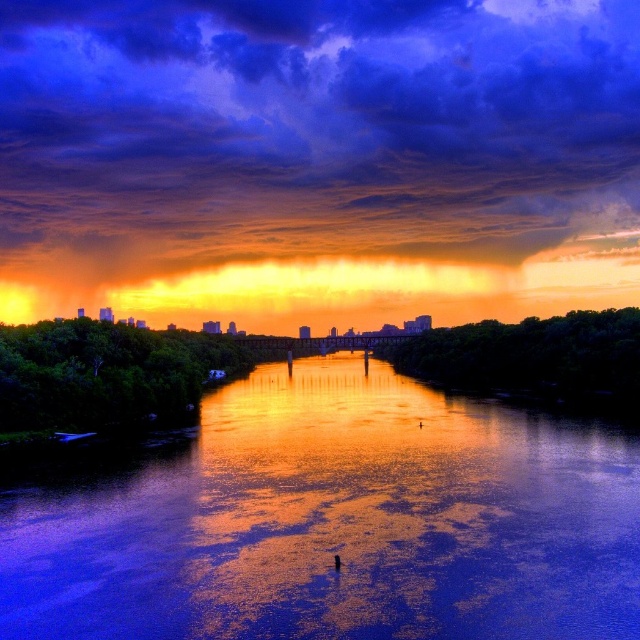
You are standing at the point with coordinates point (42, 604) and want to walk to the point with coordinates point (236, 317). However, there is a large tree blocking your path. Which point is closer to you, the starting point or the destination?

The starting point point (42, 604) is closer to you because it is the point you are currently at, while the destination point (236, 317) is behind it and farther away.